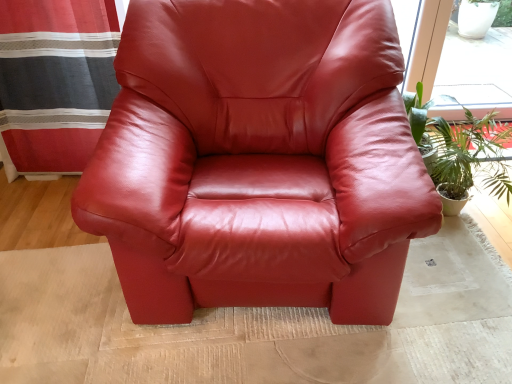
Question: From the image's perspective, is green leafy plant at right located beneath satin red armchair at center?

Choices:
 (A) yes
 (B) no

Answer: (A)

Question: From the image's perspective, would you say green leafy plant at right is positioned over satin red armchair at center?

Choices:
 (A) yes
 (B) no

Answer: (B)

Question: Can you confirm if green leafy plant at right is taller than satin red armchair at center?

Choices:
 (A) yes
 (B) no

Answer: (B)

Question: From a real-world perspective, is green leafy plant at right located beneath satin red armchair at center?

Choices:
 (A) yes
 (B) no

Answer: (A)

Question: Considering the relative sizes of green leafy plant at right and satin red armchair at center in the image provided, is green leafy plant at right wider than satin red armchair at center?

Choices:
 (A) yes
 (B) no

Answer: (B)

Question: From a real-world perspective, is green leafy plant at right positioned above or below satin red armchair at center?

Choices:
 (A) above
 (B) below

Answer: (B)

Question: Is point (468, 122) positioned closer to the camera than point (358, 112)?

Choices:
 (A) farther
 (B) closer

Answer: (A)

Question: Considering their positions, is green leafy plant at right located in front of or behind satin red armchair at center?

Choices:
 (A) front
 (B) behind

Answer: (B)

Question: In terms of height, does green leafy plant at right look taller or shorter compared to satin red armchair at center?

Choices:
 (A) short
 (B) tall

Answer: (A)

Question: Is satin red armchair at center wider or thinner than striped fabric curtain at left?

Choices:
 (A) wide
 (B) thin

Answer: (A)

Question: In the image, is satin red armchair at center positioned in front of or behind striped fabric curtain at left?

Choices:
 (A) behind
 (B) front

Answer: (B)

Question: From a real-world perspective, is satin red armchair at center positioned above or below striped fabric curtain at left?

Choices:
 (A) below
 (B) above

Answer: (B)

Question: Is satin red armchair at center to the left or to the right of striped fabric curtain at left in the image?

Choices:
 (A) right
 (B) left

Answer: (A)

Question: From the image's perspective, relative to green leafy plant at right, is satin red armchair at center above or below?

Choices:
 (A) below
 (B) above

Answer: (B)

Question: From their relative heights in the image, would you say satin red armchair at center is taller or shorter than green leafy plant at right?

Choices:
 (A) short
 (B) tall

Answer: (B)